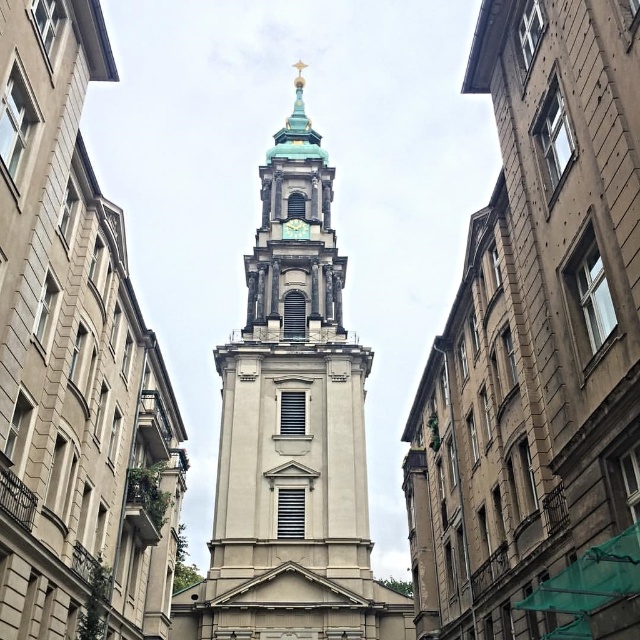
Is white stone church tower at center smaller than gold metallic clock at center?

Actually, white stone church tower at center might be larger than gold metallic clock at center.

Does point (116, 385) come farther from viewer compared to point (300, 218)?

No.

Does point (129, 540) lie behind point (301, 237)?

No.

The width and height of the screenshot is (640, 640). In order to click on white stone church tower at center in this screenshot , I will do `click(74, 358)`.

Can you confirm if white stone church at center is bigger than white stone church tower at center?

Yes, white stone church at center is bigger than white stone church tower at center.

Which is below, white stone church at center or white stone church tower at center?

white stone church at center

Measure the distance between point (x=406, y=440) and camera.

A distance of 95.96 meters exists between point (x=406, y=440) and camera.

Find the location of `white stone church at center`. white stone church at center is located at coordinates (538, 348).

Is point (332, 572) closer to viewer compared to point (289, 220)?

Yes.

Does white stone tower at center have a greater height compared to gold metallic clock at center?

Indeed, white stone tower at center has a greater height compared to gold metallic clock at center.

Is point (291, 464) more distant than point (298, 237)?

No, it is not.

Image resolution: width=640 pixels, height=640 pixels. Find the location of `white stone tower at center`. white stone tower at center is located at coordinates (291, 435).